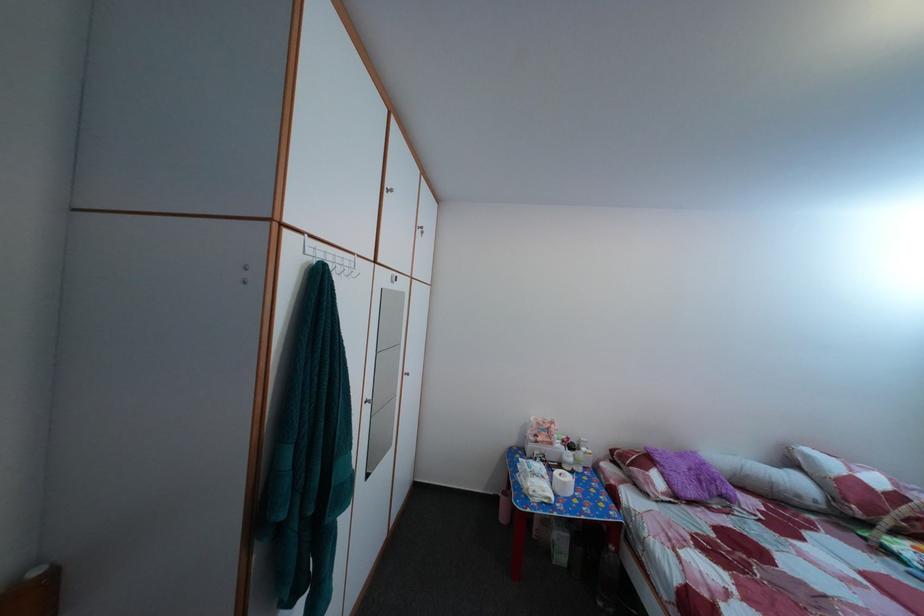
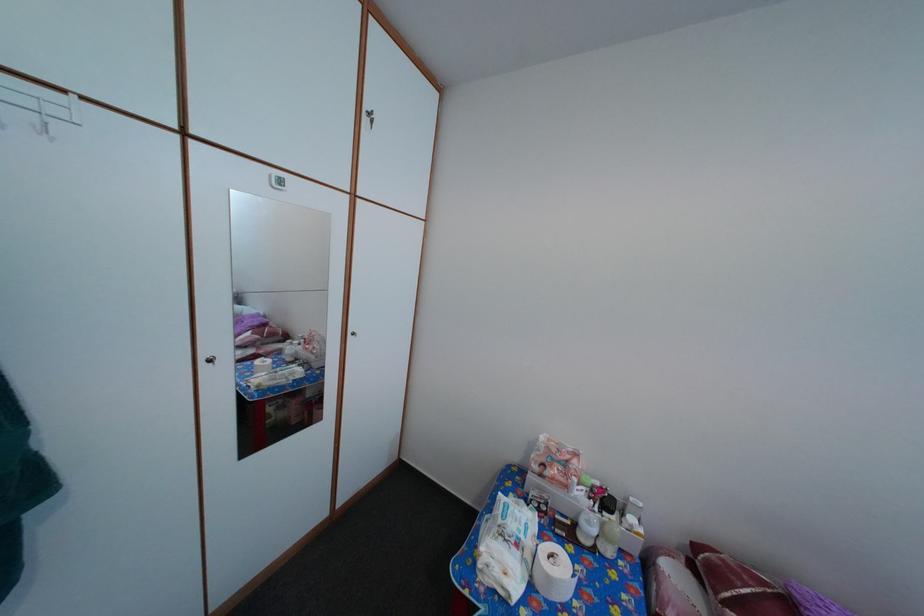
Find the pixel in the second image that matches (x=557, y=437) in the first image.

(576, 469)